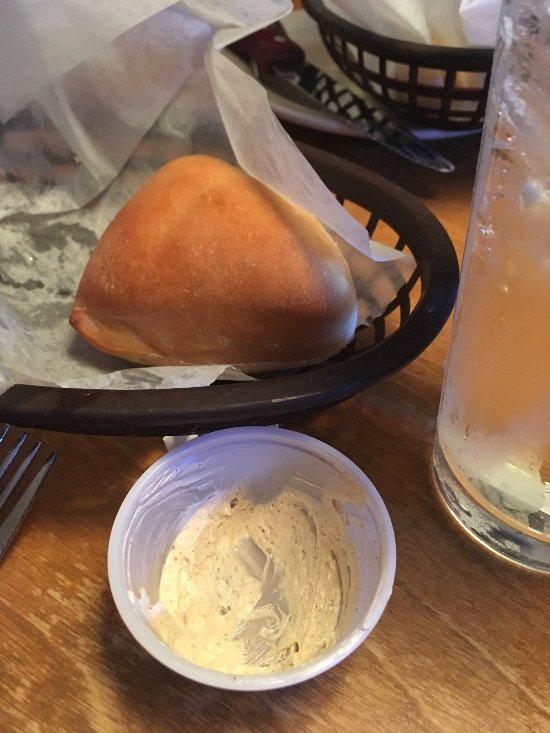
You are a GUI agent. You are given a task and a screenshot of the screen. Output one action in this format:
    pyautogui.click(x=<x>, y=<y>)
    Task: Click on the fork
    
    Given the screenshot: What is the action you would take?
    pyautogui.click(x=27, y=492)